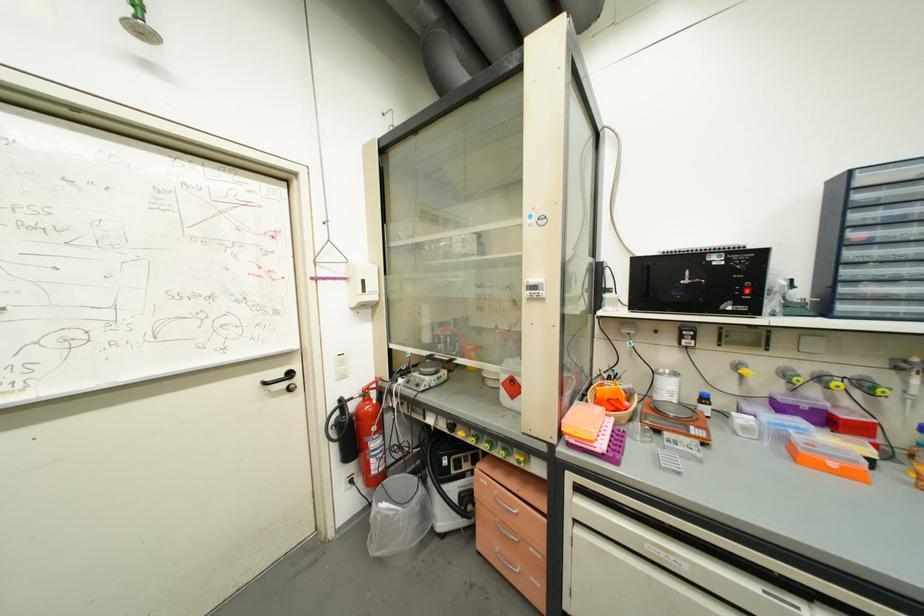
Identify the location of black door handle. (280, 392).